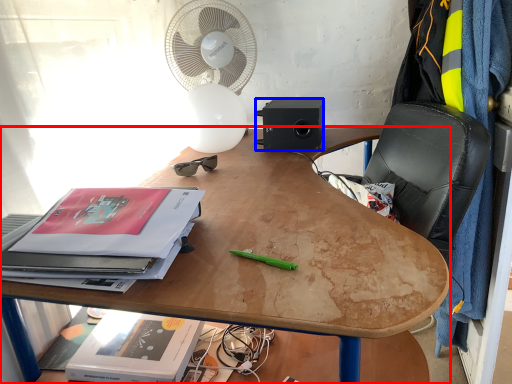
Question: Which point is closer to the camera, desk (highlighted by a red box) or loudspeaker (highlighted by a blue box)?

Choices:
 (A) desk
 (B) loudspeaker

Answer: (A)